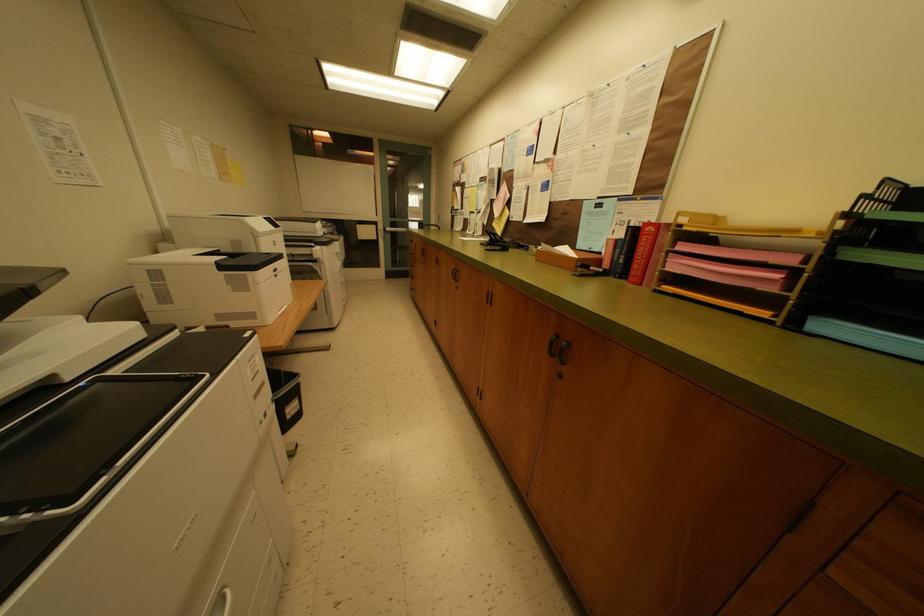
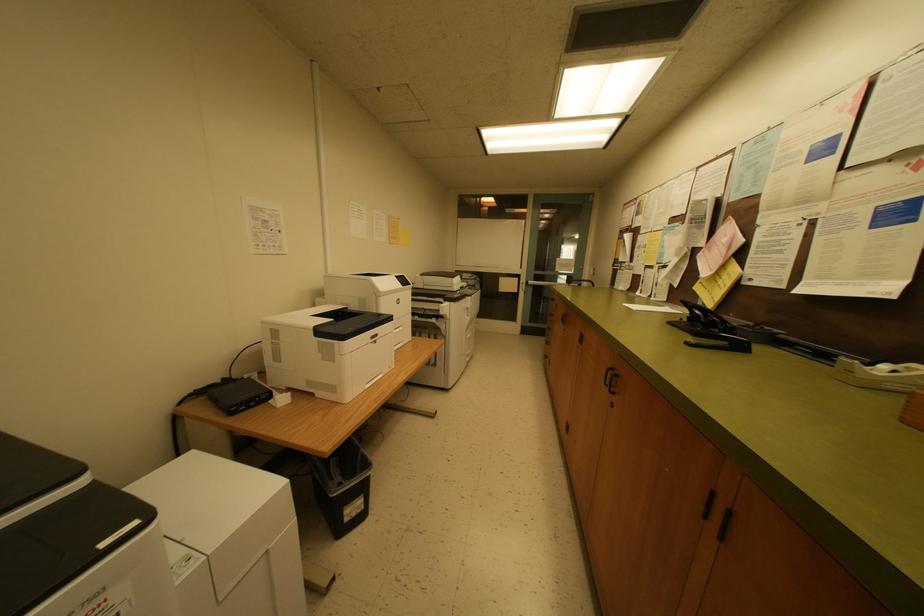
Question: How did the camera likely rotate?

Choices:
 (A) Left
 (B) Right
 (C) Up
 (D) Down

Answer: (A)